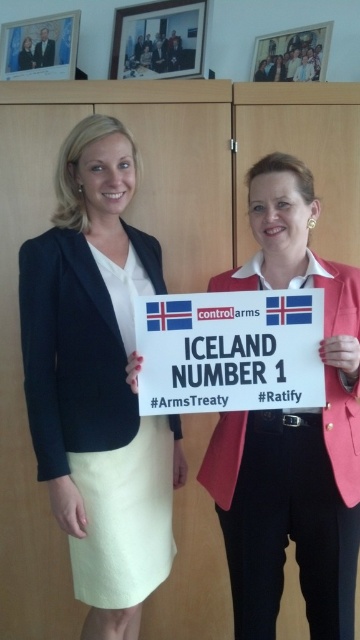
Question: Which point is farther from the camera taking this photo?

Choices:
 (A) (299, 385)
 (B) (87, 220)

Answer: (B)

Question: Can you confirm if matte black blazer at center is thinner than white paper sign at center?

Choices:
 (A) no
 (B) yes

Answer: (B)

Question: Which of the following is the closest to the observer?

Choices:
 (A) (117, 458)
 (B) (173, 406)

Answer: (B)

Question: Is matte black blazer at center above white paper sign at center?

Choices:
 (A) yes
 (B) no

Answer: (B)

Question: Is matte black blazer at center positioned before white paper sign at center?

Choices:
 (A) no
 (B) yes

Answer: (A)